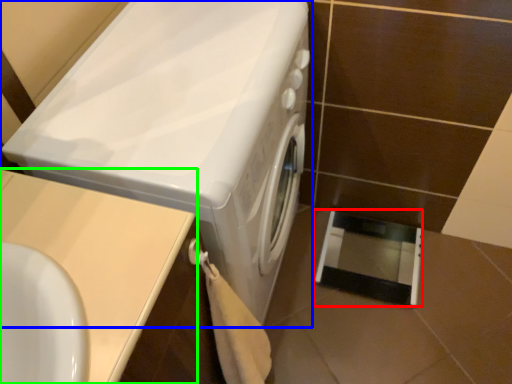
Question: Which is farther away from screen door (highlighted by a red box)? washing machine (highlighted by a blue box) or counter top (highlighted by a green box)?

Choices:
 (A) washing machine
 (B) counter top

Answer: (B)